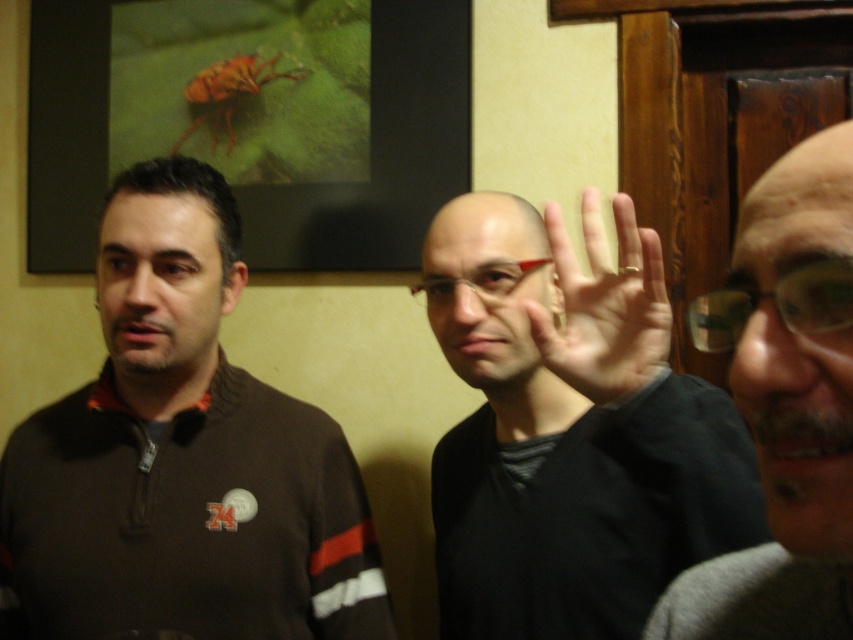
Question: Estimate the real-world distances between objects in this image. Which object is closer to the matte black frame at upper center?

Choices:
 (A) dark brown sweater at left
 (B) smooth gray sweater at right

Answer: (A)

Question: Which point is farther from the camera taking this photo?

Choices:
 (A) (248, 634)
 (B) (584, 244)
 (C) (454, 154)

Answer: (C)

Question: Considering the real-world distances, which object is closest to the black matte hand at center?

Choices:
 (A) matte black frame at upper center
 (B) orange matte insect at upper left

Answer: (A)

Question: From the image, what is the correct spatial relationship of glossy skin at upper right in relation to orange matte insect at upper left?

Choices:
 (A) left
 (B) right

Answer: (B)

Question: Can you confirm if matte brown face at left is thinner than transparent plastic glasses at center?

Choices:
 (A) no
 (B) yes

Answer: (A)

Question: Does smooth gray sweater at right appear under matte black glasses at center?

Choices:
 (A) no
 (B) yes

Answer: (B)